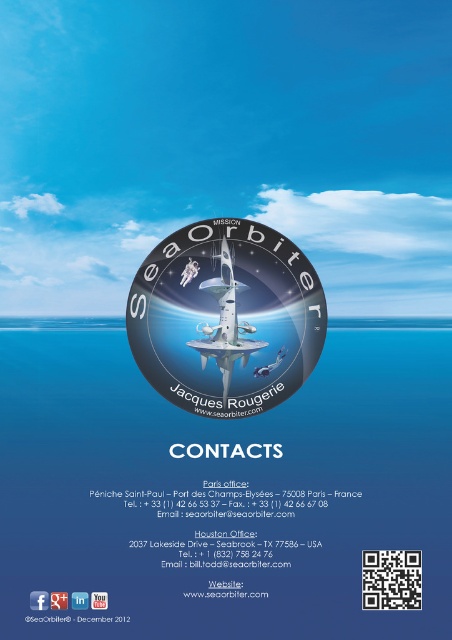
You are an architect designing a museum exhibit about futuristic marine exploration. You need to display both the glossy metallic seaorbiter at center and the white glossy rocket at center. Which object should be placed higher on the display stand to accurately represent their sizes as shown in the image?

The glossy metallic seaorbiter at center should be placed higher on the display stand because it has a greater height compared to the white glossy rocket at center, as shown in the image.

You are an astronaut who just returned from a space mission and now you are looking at the promotional poster for SeaOrbiter. You see the glossy metallic seaorbiter at center and the white glossy rocket at center. Which object in the poster is larger?

The glossy metallic seaorbiter at center is bigger than the white glossy rocket at center.